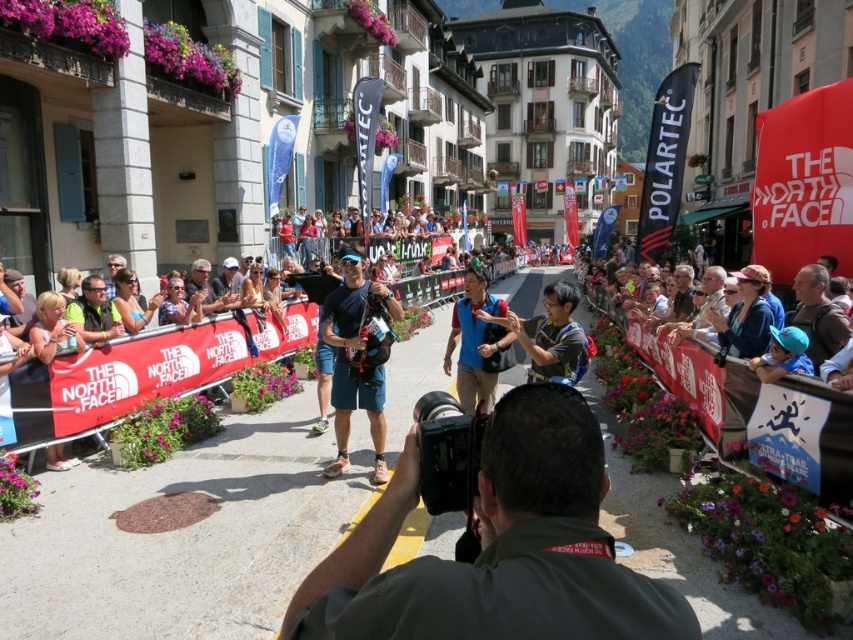
You are a spectator at the event and want to take a photo of the dark gray uniform at center and the matte blue shorts at center. Which one is positioned to the right of the other?

The dark gray uniform at center is to the right of the matte blue shorts at center.

Looking at this image, you are a photographer at the event and need to determine which piece of clothing is smaller between the dark gray uniform at center and the matte blue shorts at center. Based on the scene, which one is smaller?

The dark gray uniform at center is smaller compared to the matte blue shorts at center according to the description.

You are a photographer at the event and want to ensure your equipment fits in your bag. The bag has a width capacity of 15 inches. If the matte blue shirt at center is 12 inches wide and the matte black sunglasses at center is 9 inches wide, can both items fit side by side in the bag?

The matte blue shirt at center is 12 inches wide and the matte black sunglasses at center is 9 inches wide. Combined, they total 21 inches, which exceeds the bag capacity of 15 inches. Therefore, both items cannot fit side by side in the bag.